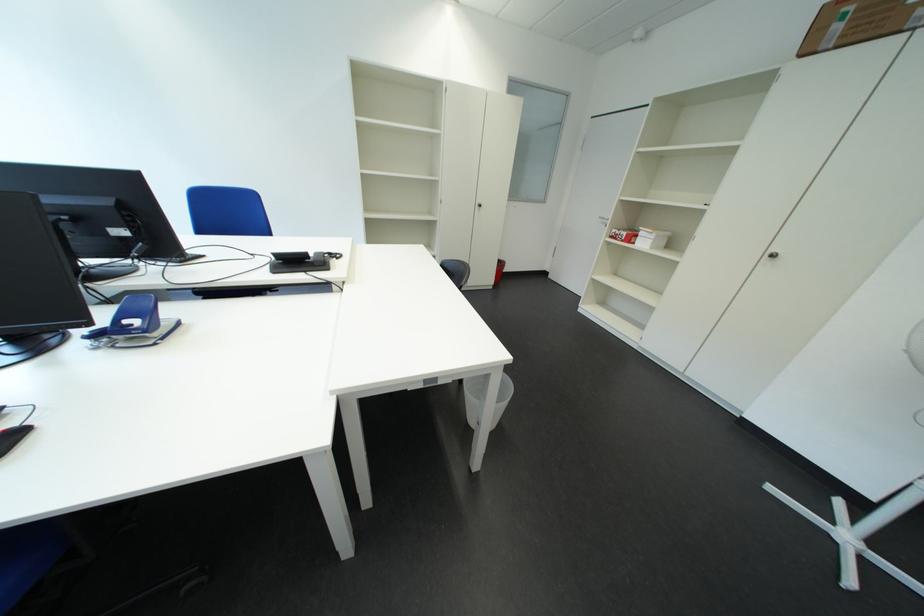
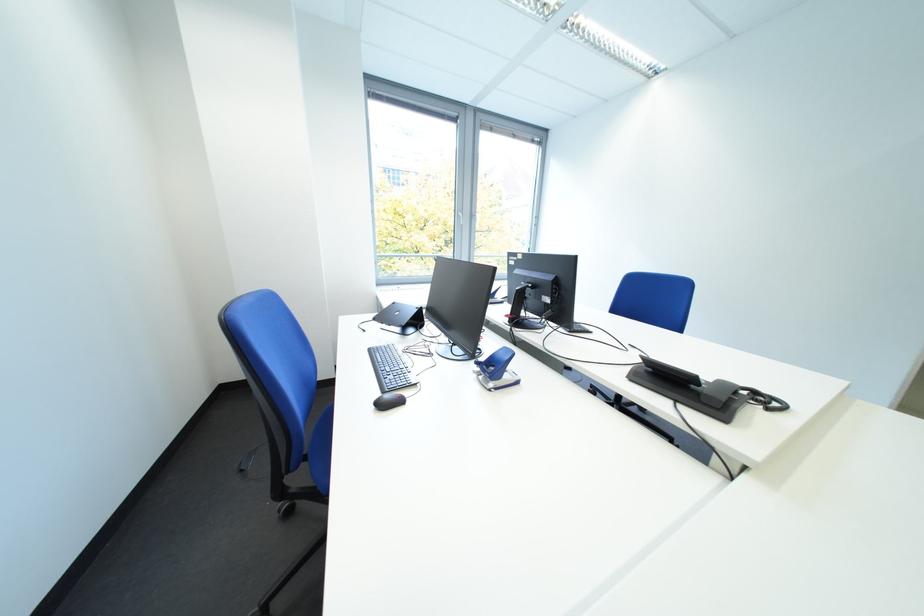
Question: The first image is from the beginning of the video and the second image is from the end. How did the camera likely rotate when shooting the video?

Choices:
 (A) Left
 (B) Right
 (C) Up
 (D) Down

Answer: (A)